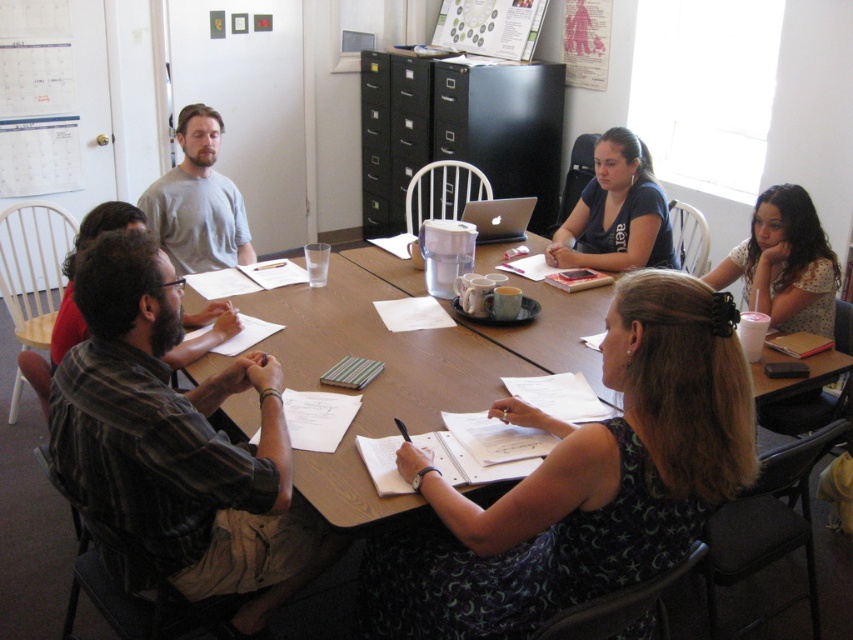
Question: Which point is closer to the camera?

Choices:
 (A) wooden table at center
 (B) light brown hair at lower right

Answer: (A)

Question: Which point is farther to the camera?

Choices:
 (A) (209, 243)
 (B) (762, 228)
 (C) (469, 358)
 (D) (107, 467)

Answer: (A)

Question: Is light brown hair at lower right thinner than gray cotton shirt at upper left?

Choices:
 (A) yes
 (B) no

Answer: (A)

Question: Which point appears farthest from the camera in this image?

Choices:
 (A) (242, 260)
 (B) (631, 202)
 (C) (759, 284)

Answer: (A)

Question: Can you confirm if light brown hair at lower right is smaller than dark blue t-shirt at upper right?

Choices:
 (A) no
 (B) yes

Answer: (B)

Question: Can you confirm if black fabric dress at center is positioned to the left of gray cotton shirt at upper left?

Choices:
 (A) yes
 (B) no

Answer: (B)